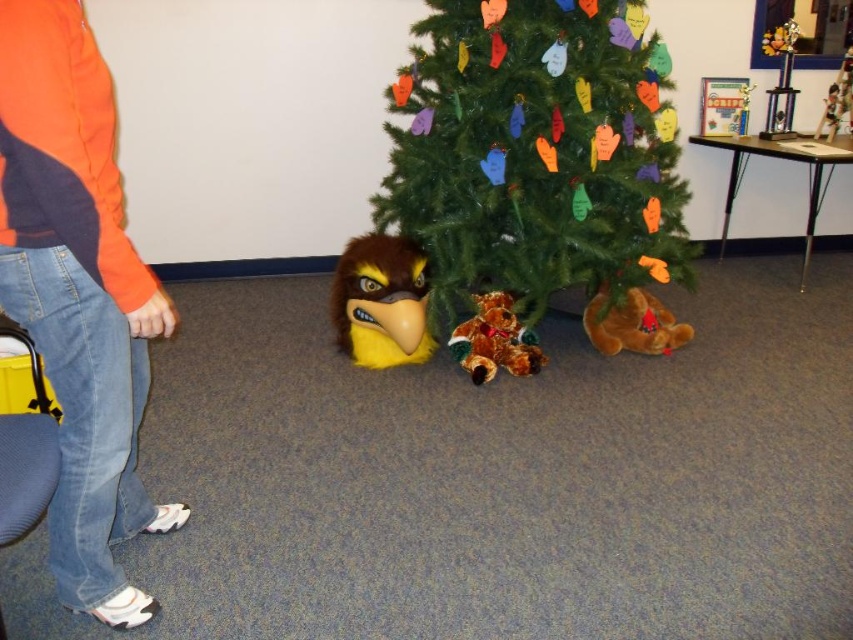
Which is more to the left, yellow plush eagle at lower center or orange plush toy at lower right?

yellow plush eagle at lower center

Who is positioned more to the right, yellow plush eagle at lower center or orange plush toy at lower right?

orange plush toy at lower right is more to the right.

Based on the photo, who is more distant from viewer, (393,356) or (653,300)?

Point (653,300)

The width and height of the screenshot is (853, 640). Identify the location of yellow plush eagle at lower center. (381, 301).

Who is higher up, green matte christmas tree at center or fuzzy brown teddy bear at center?

green matte christmas tree at center is above.

How distant is green matte christmas tree at center from fuzzy brown teddy bear at center?

green matte christmas tree at center is 17.63 inches away from fuzzy brown teddy bear at center.

Image resolution: width=853 pixels, height=640 pixels. Identify the location of green matte christmas tree at center. (537, 154).

Does orange fleece jacket at upper left have a smaller size compared to yellow plush eagle at lower center?

No, orange fleece jacket at upper left is not smaller than yellow plush eagle at lower center.

Is point (67, 420) more distant than point (415, 275)?

No, it is in front of (415, 275).

This screenshot has height=640, width=853. Find the location of `orange fleece jacket at upper left`. orange fleece jacket at upper left is located at coordinates (78, 294).